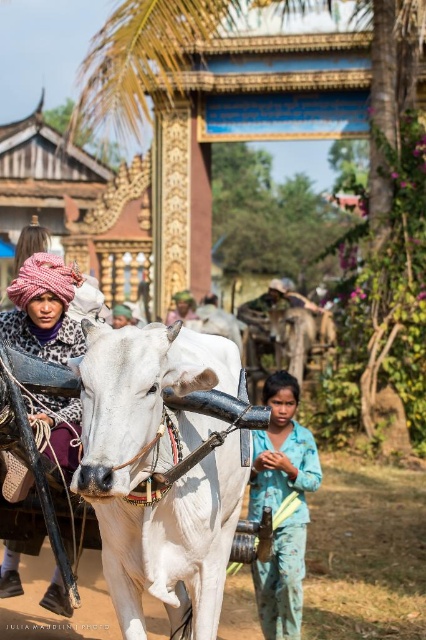
You are a tailor observing the blue cotton shirt at center and the knitted pink turban at left in the image. Which clothing item has a narrower width?

The blue cotton shirt at center has a narrower width than the knitted pink turban at left according to the description.

You are a traveler observing the scene and need to describe the clothing details of the two people present. Which clothing item is shorter in height between the blue cotton shirt at center and the knitted pink turban at left?

The blue cotton shirt at center has a lesser height compared to the knitted pink turban at left, so the blue cotton shirt at center is shorter in height.